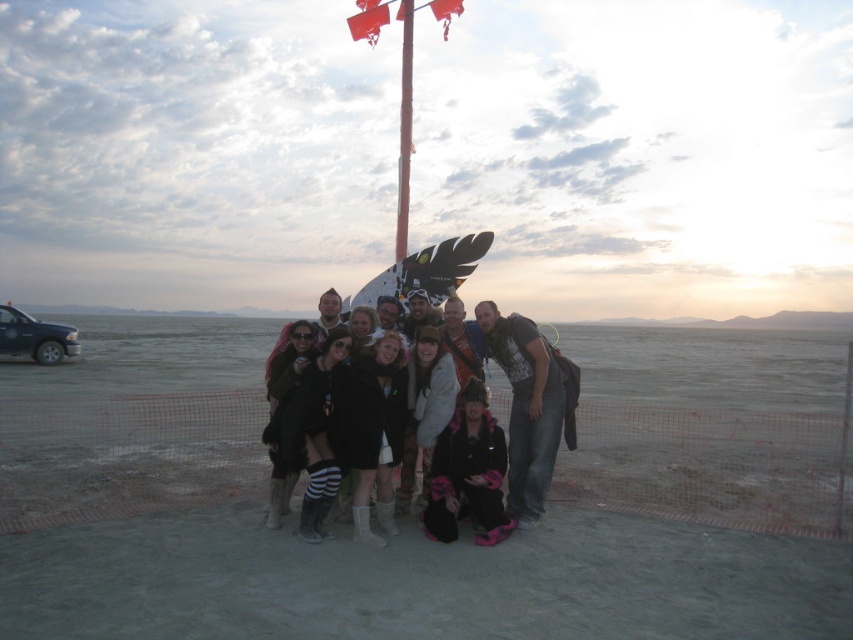
Does black leather jacket at center appear under red fabric flag at upper center?

Correct, black leather jacket at center is located below red fabric flag at upper center.

Can you confirm if black leather jacket at center is taller than red fabric flag at upper center?

Correct, black leather jacket at center is much taller as red fabric flag at upper center.

Does point (286, 371) come farther from viewer compared to point (364, 8)?

No.

Find the location of a particular element. This screenshot has height=640, width=853. black leather jacket at center is located at coordinates point(399,388).

Does point (552, 420) lie in front of point (384, 435)?

No.

Can you confirm if denim jeans at center is taller than black leather jacket at center?

Yes.

Is point (560, 428) closer to viewer compared to point (395, 456)?

No, it is not.

Where is `denim jeans at center`? denim jeans at center is located at coordinates (526, 406).

Which is behind, point (399, 253) or point (410, 42)?

The point (399, 253) is more distant.

Based on the photo, can you confirm if smooth red pole at center is positioned below white glossy flag pole at center?

No, smooth red pole at center is not below white glossy flag pole at center.

Describe the element at coordinates (410, 104) in the screenshot. I see `smooth red pole at center` at that location.

Identify the location of smooth red pole at center. (410, 104).